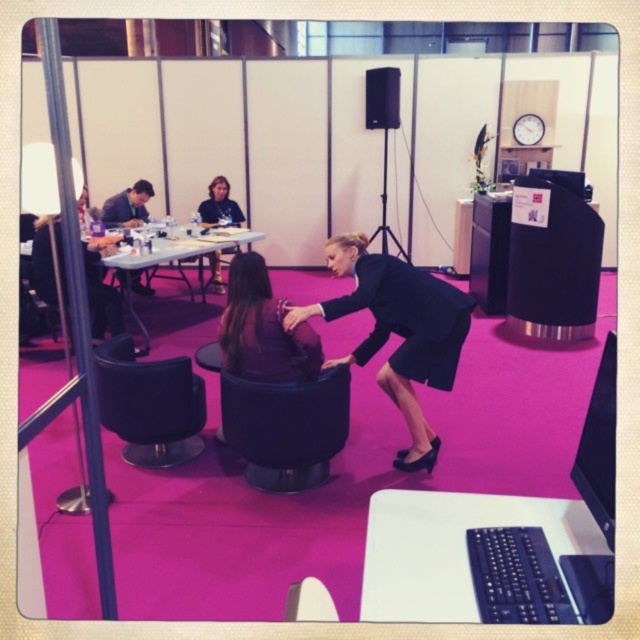
Question: Which object is farther from the camera taking this photo?

Choices:
 (A) dark blue fabric chair at center
 (B) white plastic round table at center
 (C) white plastic table at center
 (D) black fabric skirt at center

Answer: (A)

Question: Which point appears farthest from the camera in this image?

Choices:
 (A) (376, 268)
 (B) (211, 269)

Answer: (B)

Question: In this image, where is purple fabric chair at center located relative to black matte speaker at upper center?

Choices:
 (A) right
 (B) left

Answer: (B)

Question: Can you confirm if black fabric skirt at center is bigger than purple fabric chair at center?

Choices:
 (A) yes
 (B) no

Answer: (A)

Question: Among these objects, which one is nearest to the camera?

Choices:
 (A) purple fabric chair at center
 (B) black leather chair at center

Answer: (A)

Question: Does white plastic round table at center appear under dark blue fabric chair at center?

Choices:
 (A) no
 (B) yes

Answer: (B)